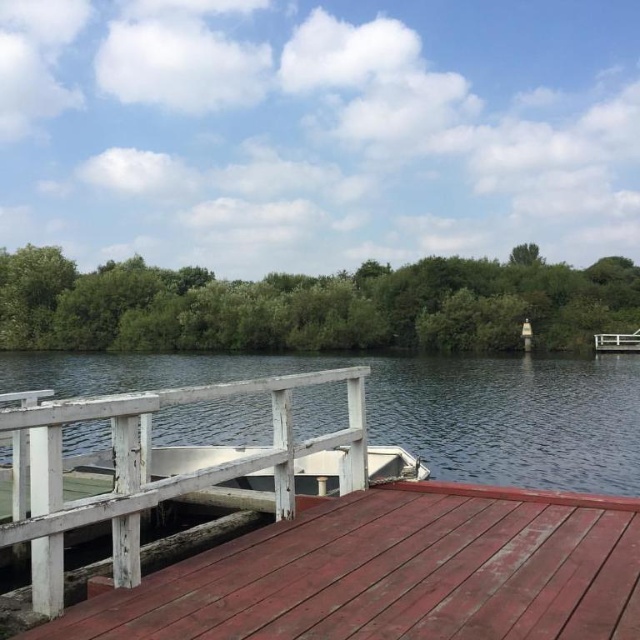
You are standing on the lakeside path and want to take a photo of the rustic wood deck at center and the clear water at dock center. Which object will appear larger in your photo?

The rustic wood deck at center will appear larger in the photo because it is closer to the viewer than the clear water at dock center.